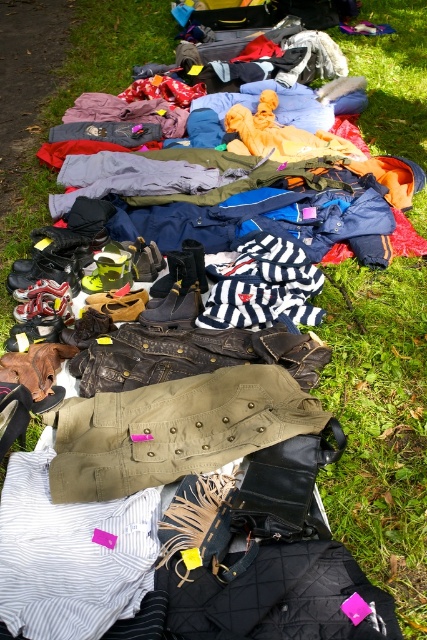
You are a customer at an outdoor flea market, and you see a khaki cotton jacket at center and a striped cotton shirt at center. Which item is visible on top of the other?

The khaki cotton jacket at center is located above striped cotton shirt at center, so the khaki cotton jacket at center is visible on top of the striped cotton shirt at center.

You are a customer at a flea market and want to pick up the khaki cotton jacket at center and the striped cotton shirt at center. Which item should you reach for first to avoid disturbing the other items?

You should reach for the khaki cotton jacket at center first because it is closer to you than the striped cotton shirt at center, which is underneath it.

You are setting up a display for a clothing store and need to arrange the khaki cotton jacket at center and the striped cotton shirt at center on a shelf. If the shelf has limited space, which item should you place first to ensure both fit?

The striped cotton shirt at center has a smaller width than the khaki cotton jacket at center. To ensure both items fit on the shelf, place the wider khaki cotton jacket at center first, then the narrower striped cotton shirt at center next.